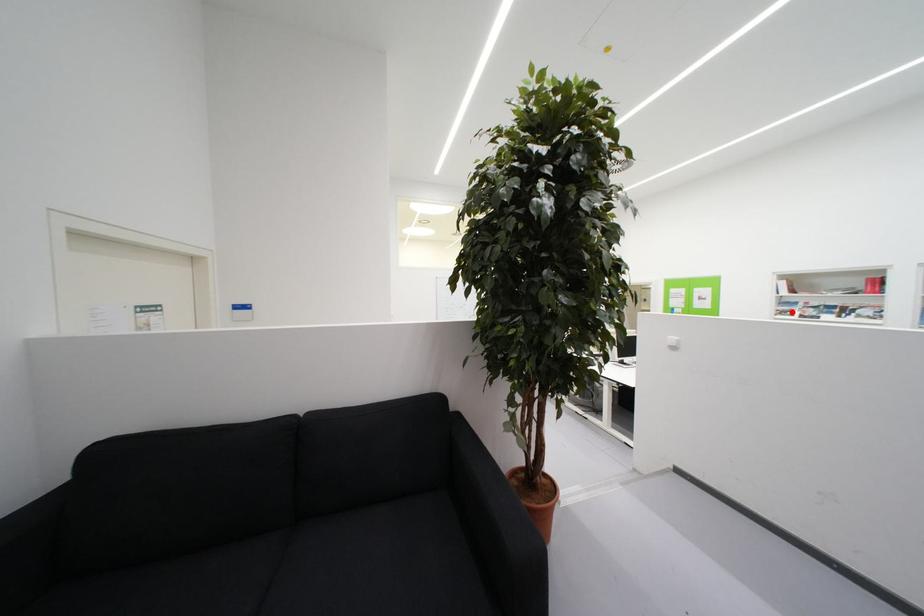
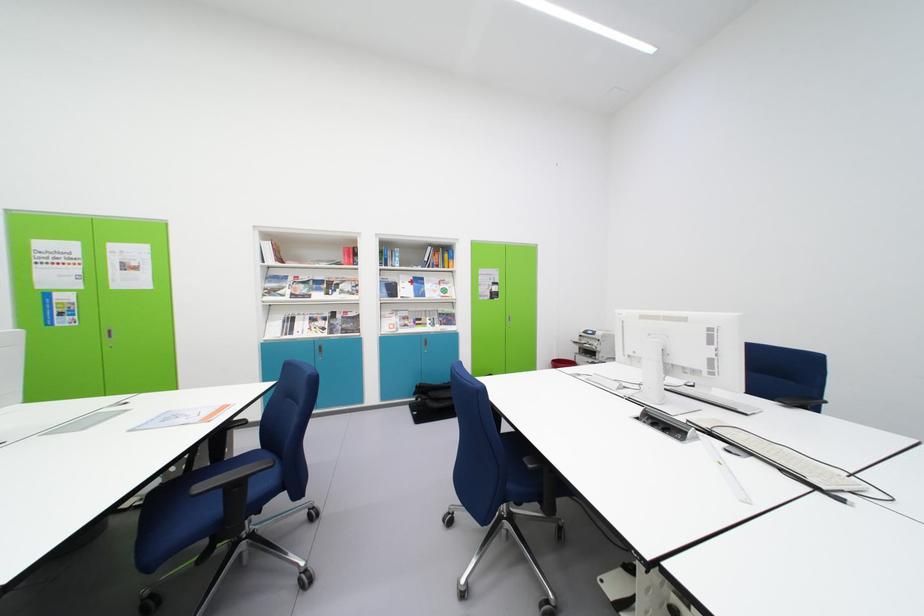
Question: I am providing you with two images of the same scene from different viewpoints. A red point is marked on the first image. At the location where the point appears in image 1, is it still visible in image 2?

Choices:
 (A) Yes
 (B) No

Answer: (A)